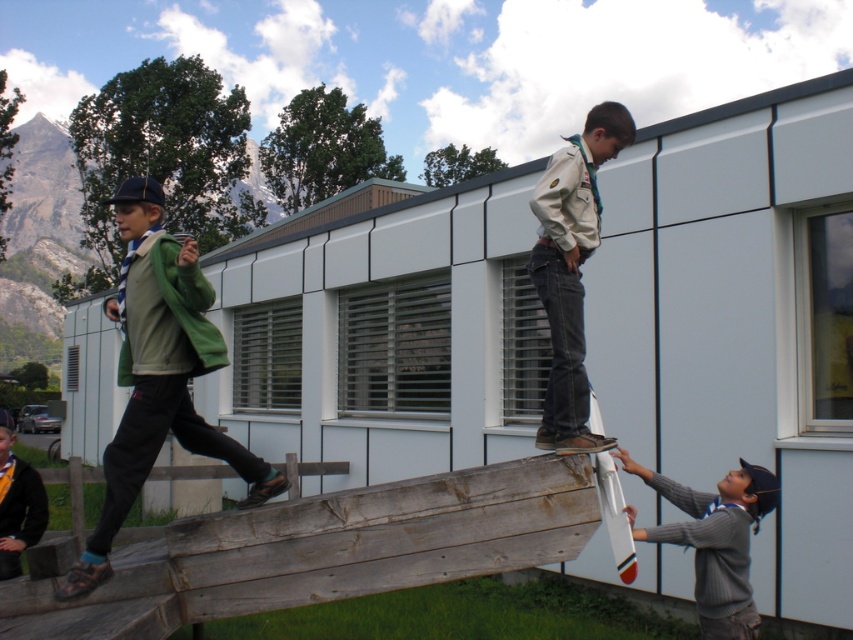
Who is more distant from viewer, (581, 442) or (711, 500)?

Point (711, 500)

Is denim jeans at upper center to the right of gray knitted sweater at lower right from the viewer's perspective?

In fact, denim jeans at upper center is to the left of gray knitted sweater at lower right.

Who is more distant from viewer, (576, 284) or (747, 566)?

The point (747, 566) is more distant.

Where is `denim jeans at upper center`? Image resolution: width=853 pixels, height=640 pixels. denim jeans at upper center is located at coordinates (572, 269).

Does green fabric jacket at left come in front of denim jeans at upper center?

Yes, it is in front of denim jeans at upper center.

Is green fabric jacket at left to the right of denim jeans at upper center from the viewer's perspective?

No, green fabric jacket at left is not to the right of denim jeans at upper center.

Who is more forward, (142,388) or (576,417)?

Point (142,388) is in front.

Find the location of a particular element. This screenshot has height=640, width=853. green fabric jacket at left is located at coordinates (158, 372).

Can you confirm if green fabric jacket at left is positioned below gray knitted sweater at lower right?

No, green fabric jacket at left is not below gray knitted sweater at lower right.

Does green fabric jacket at left have a greater width compared to gray knitted sweater at lower right?

No.

Between point (126, 237) and point (664, 540), which one is positioned in front?

Positioned in front is point (126, 237).

You are a GUI agent. You are given a task and a screenshot of the screen. Output one action in this format:
    pyautogui.click(x=<x>, y=<y>)
    Task: Click on the green fabric jacket at left
    The height and width of the screenshot is (640, 853).
    Given the screenshot: What is the action you would take?
    pyautogui.click(x=158, y=372)